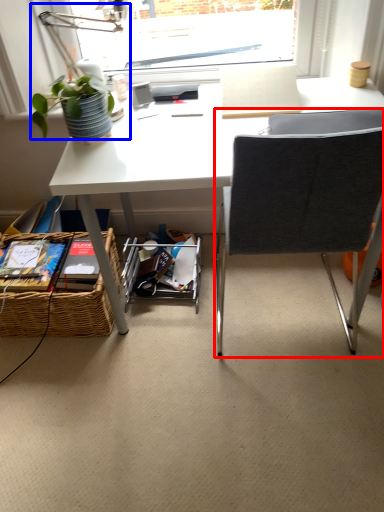
Question: Which point is closer to the camera, chair (highlighted by a red box) or table lamp (highlighted by a blue box)?

Choices:
 (A) chair
 (B) table lamp

Answer: (A)